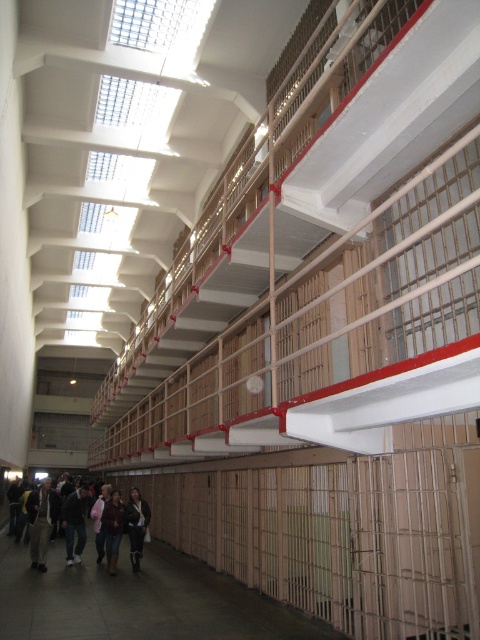
Question: Considering the real-world distances, which object is closest to the dark brown leather jacket at center?

Choices:
 (A) pink fabric jacket at lower center
 (B) dark gray jacket at lower left
 (C) dark gray pants at lower left
 (D) dark brown leather jacket at lower left

Answer: (A)

Question: Does dark gray jacket at lower left have a smaller size compared to dark brown leather jacket at center?

Choices:
 (A) yes
 (B) no

Answer: (B)

Question: Does dark gray pants at lower left come in front of dark brown leather jacket at center?

Choices:
 (A) no
 (B) yes

Answer: (B)

Question: Is the position of dark brown leather jacket at center more distant than that of pink fabric jacket at lower center?

Choices:
 (A) yes
 (B) no

Answer: (A)

Question: Which object is farther from the camera taking this photo?

Choices:
 (A) dark brown leather jacket at lower left
 (B) dark gray pants at lower left

Answer: (A)

Question: Estimate the real-world distances between objects in this image. Which object is farther from the dark brown leather jacket at center?

Choices:
 (A) dark gray pants at lower left
 (B) dark brown leather jacket at lower left
 (C) pink fabric jacket at lower center

Answer: (A)